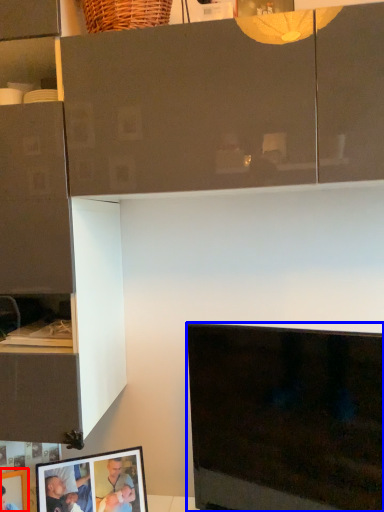
Question: Which of the following is the closest to the observer, picture frame (highlighted by a red box) or television (highlighted by a blue box)?

Choices:
 (A) picture frame
 (B) television

Answer: (B)